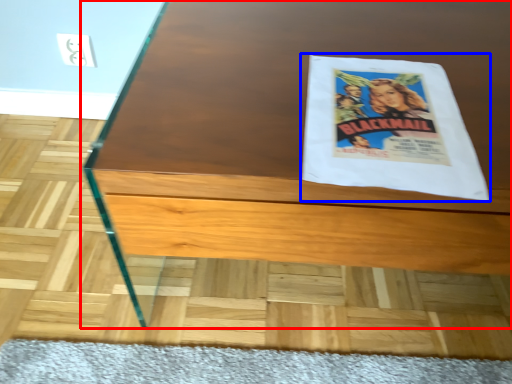
Question: Which object is closer to the camera taking this photo, table (highlighted by a red box) or flyer (highlighted by a blue box)?

Choices:
 (A) table
 (B) flyer

Answer: (A)